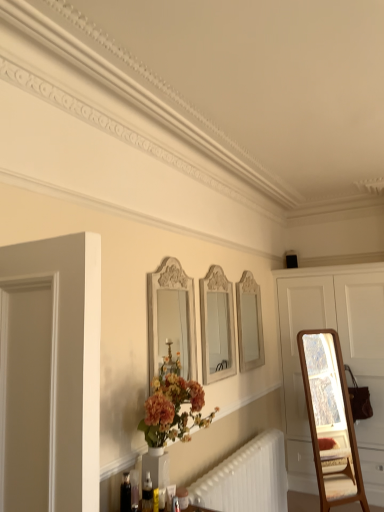
Question: From the image's perspective, does white glossy mirror at upper center, which is the third mirror in front-to-back order, appear lower than translucent plastic bottle at lower center?

Choices:
 (A) yes
 (B) no

Answer: (B)

Question: From a real-world perspective, is white glossy mirror at upper center, which is counted as the first mirror, starting from the right, located higher than translucent plastic bottle at lower center?

Choices:
 (A) no
 (B) yes

Answer: (B)

Question: Can you confirm if white glossy mirror at upper center, the third mirror from the left, is wider than translucent plastic bottle at lower center?

Choices:
 (A) no
 (B) yes

Answer: (B)

Question: Is white glossy mirror at upper center, the third mirror from the left, located outside translucent plastic bottle at lower center?

Choices:
 (A) yes
 (B) no

Answer: (A)

Question: Is white glossy mirror at upper center, the third mirror from the left, at the right side of translucent plastic bottle at lower center?

Choices:
 (A) yes
 (B) no

Answer: (A)

Question: Based on their positions, is translucent plastic bottle at lower center located to the left or right of white glossy mirror at center, the second mirror in the left-to-right sequence?

Choices:
 (A) right
 (B) left

Answer: (B)

Question: Is point [x=152, y=505] closer or farther from the camera than point [x=231, y=320]?

Choices:
 (A) farther
 (B) closer

Answer: (B)

Question: Based on their sizes in the image, would you say translucent plastic bottle at lower center is bigger or smaller than white glossy mirror at center, which is the second mirror from right to left?

Choices:
 (A) small
 (B) big

Answer: (A)

Question: From the image's perspective, is translucent plastic bottle at lower center above or below white glossy mirror at center, which is the second mirror from right to left?

Choices:
 (A) below
 (B) above

Answer: (A)

Question: Based on their positions, is white glossy mirror at center, the second mirror in the left-to-right sequence, located to the left or right of white carved wood mirror at center, which ranks as the 3th mirror in right-to-left order?

Choices:
 (A) left
 (B) right

Answer: (B)

Question: Looking at their shapes, would you say white glossy mirror at center, the second mirror in the left-to-right sequence, is wider or thinner than white carved wood mirror at center, the first mirror when ordered from left to right?

Choices:
 (A) wide
 (B) thin

Answer: (A)

Question: From the image's perspective, is white glossy mirror at center, which is the 2th mirror from back to front, positioned above or below white carved wood mirror at center, the first mirror in the front-to-back sequence?

Choices:
 (A) above
 (B) below

Answer: (B)

Question: From a real-world perspective, is white glossy mirror at center, which is the second mirror from right to left, positioned above or below white carved wood mirror at center, the first mirror when ordered from left to right?

Choices:
 (A) above
 (B) below

Answer: (B)

Question: From a real-world perspective, is white wooden dresser at right above or below white glossy mirror at upper center, which is the third mirror in front-to-back order?

Choices:
 (A) below
 (B) above

Answer: (A)

Question: From the image's perspective, is white wooden dresser at right positioned above or below white glossy mirror at upper center, the third mirror from the left?

Choices:
 (A) above
 (B) below

Answer: (B)